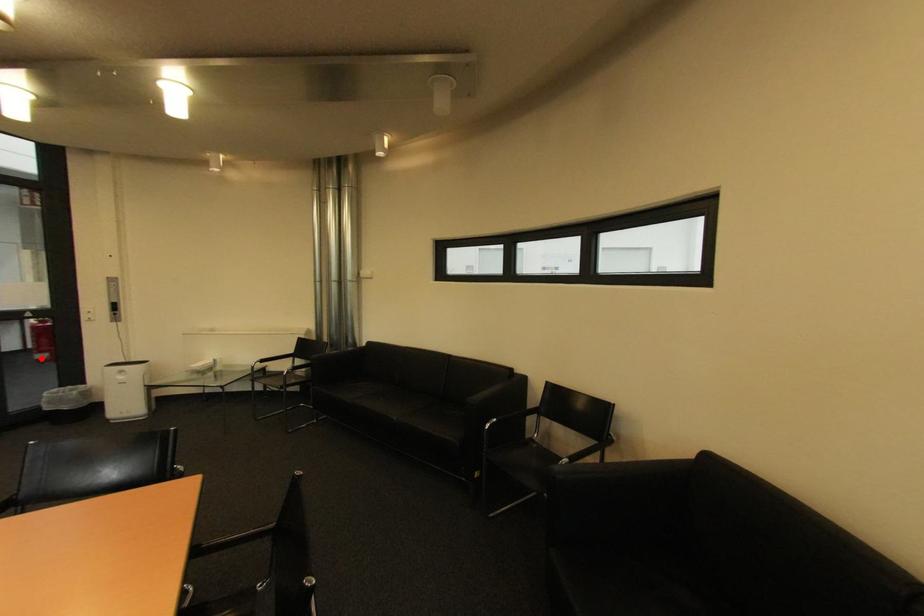
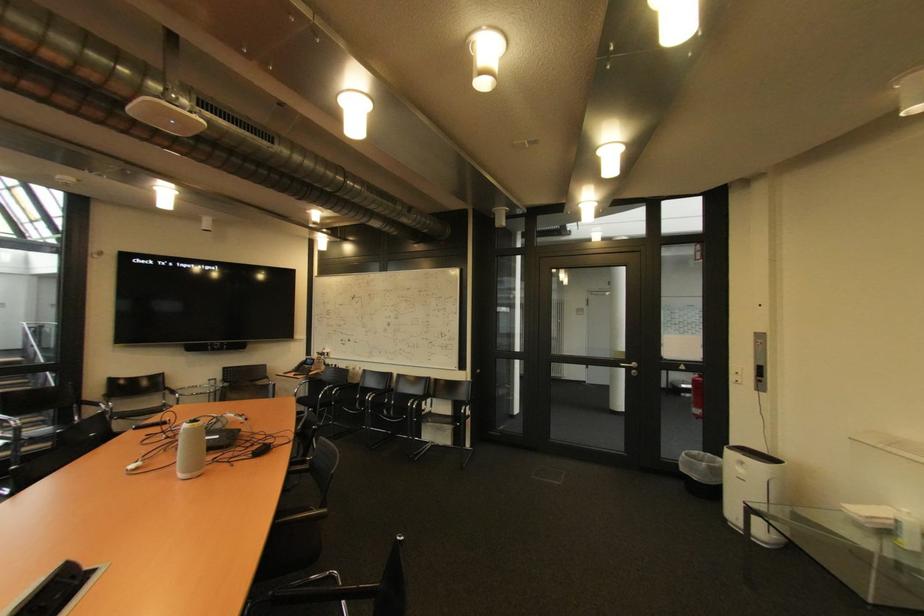
Locate, in the second image, the point that corresponds to the highlighted location in the first image.

(699, 411)